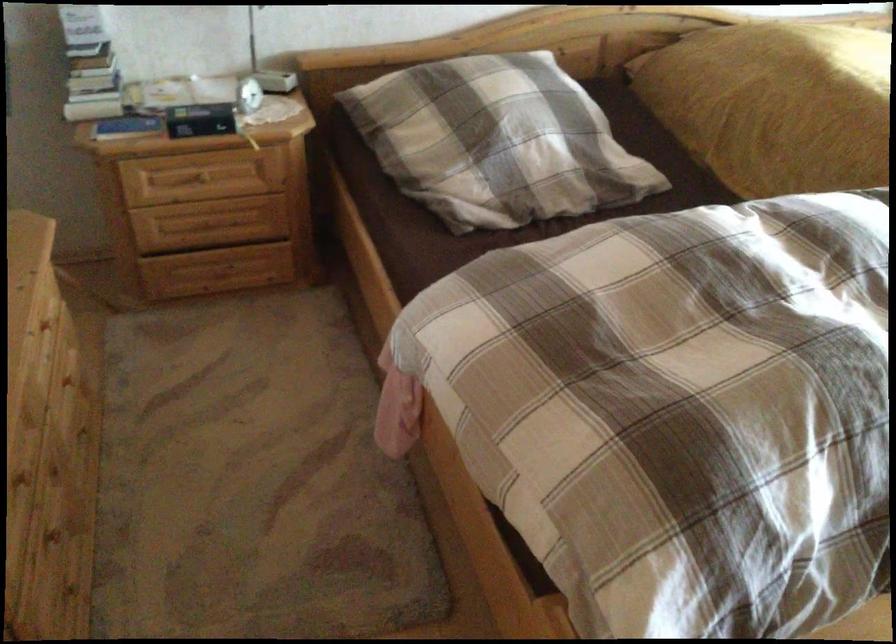
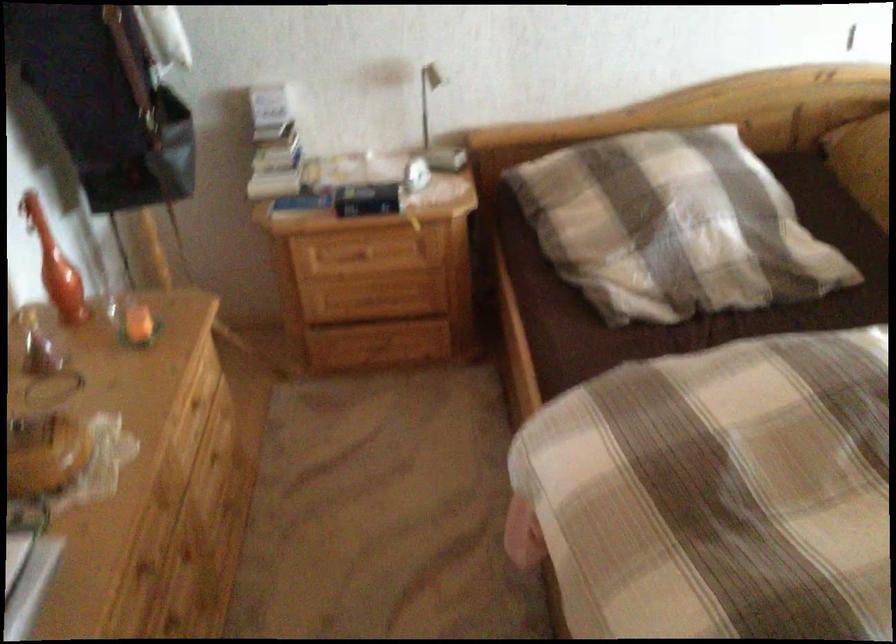
Find the pixel in the second image that matches pixel 134 131 in the first image.

(304, 202)